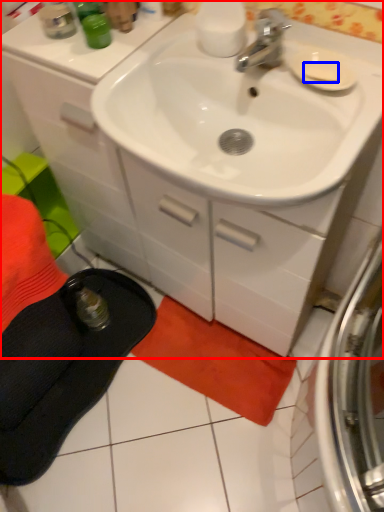
Question: Which point is further to the camera, bathroom cabinet (highlighted by a red box) or soap (highlighted by a blue box)?

Choices:
 (A) bathroom cabinet
 (B) soap

Answer: (B)